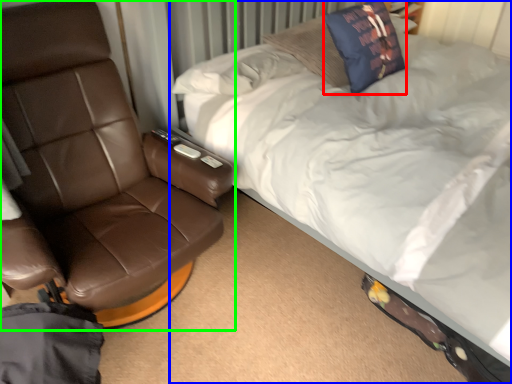
Question: Which object is positioned closest to throw pillow (highlighted by a red box)? Select from bed (highlighted by a blue box) and chair (highlighted by a green box).

Choices:
 (A) bed
 (B) chair

Answer: (A)